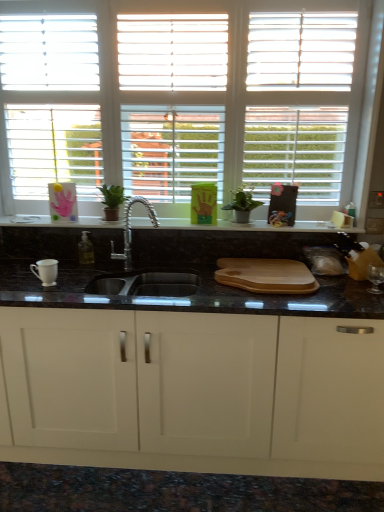
Question: Is wooden cutting board at center taller or shorter than white matte window at upper center?

Choices:
 (A) tall
 (B) short

Answer: (B)

Question: In terms of width, does wooden cutting board at center look wider or thinner when compared to white matte window at upper center?

Choices:
 (A) thin
 (B) wide

Answer: (B)

Question: Estimate the real-world distances between objects in this image. Which object is closer to the white matte window at upper center?

Choices:
 (A) white matte cabinet at center
 (B) black granite cutting board at center
 (C) wooden cutting board at center
 (D) polished chrome faucet at center
 (E) green matte plant at center

Answer: (B)

Question: Estimate the real-world distances between objects in this image. Which object is farther from the wooden cutting board at center?

Choices:
 (A) polished chrome faucet at center
 (B) white matte window at upper center
 (C) green matte plant at center
 (D) black granite cutting board at center
 (E) white matte cabinet at center

Answer: (B)